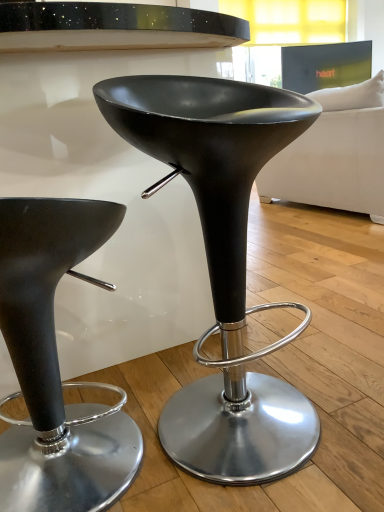
Question: Which direction should I rotate to look at matte black stool at center, which is the first stool from right to left, — up or down?

Choices:
 (A) down
 (B) up

Answer: (A)

Question: Is matte black stool at center, the 1th stool in the left-to-right sequence, surrounded by white fabric couch at upper right?

Choices:
 (A) no
 (B) yes

Answer: (A)

Question: Does white fabric couch at upper right have a larger size compared to matte black stool at center, the second stool in the right-to-left sequence?

Choices:
 (A) yes
 (B) no

Answer: (A)

Question: Does white fabric couch at upper right turn towards matte black stool at center, the 1th stool in the left-to-right sequence?

Choices:
 (A) no
 (B) yes

Answer: (A)

Question: Does white fabric couch at upper right have a smaller size compared to matte black stool at center, the 1th stool in the left-to-right sequence?

Choices:
 (A) no
 (B) yes

Answer: (A)

Question: Is white fabric couch at upper right oriented away from matte black stool at center, the 1th stool in the left-to-right sequence?

Choices:
 (A) yes
 (B) no

Answer: (A)

Question: Is white fabric couch at upper right thinner than matte black stool at center, the 1th stool in the left-to-right sequence?

Choices:
 (A) yes
 (B) no

Answer: (B)

Question: Is white fabric couch at upper right to the right of matte black stool at center, positioned as the 2th stool in left-to-right order, from the viewer's perspective?

Choices:
 (A) no
 (B) yes

Answer: (B)

Question: Does white fabric couch at upper right have a greater height compared to matte black stool at center, positioned as the 2th stool in left-to-right order?

Choices:
 (A) yes
 (B) no

Answer: (A)

Question: Is white fabric couch at upper right shorter than matte black stool at center, which is the first stool from right to left?

Choices:
 (A) no
 (B) yes

Answer: (A)

Question: Would you consider white fabric couch at upper right to be distant from matte black stool at center, which is the first stool from right to left?

Choices:
 (A) yes
 (B) no

Answer: (A)

Question: From the image's perspective, is white fabric couch at upper right located beneath matte black stool at center, positioned as the 2th stool in left-to-right order?

Choices:
 (A) yes
 (B) no

Answer: (B)

Question: Is white fabric couch at upper right next to matte black stool at center, which is the first stool from right to left, and touching it?

Choices:
 (A) yes
 (B) no

Answer: (B)

Question: From a real-world perspective, is matte black stool at center, the second stool in the right-to-left sequence, located higher than matte black stool at center, which is the first stool from right to left?

Choices:
 (A) yes
 (B) no

Answer: (B)